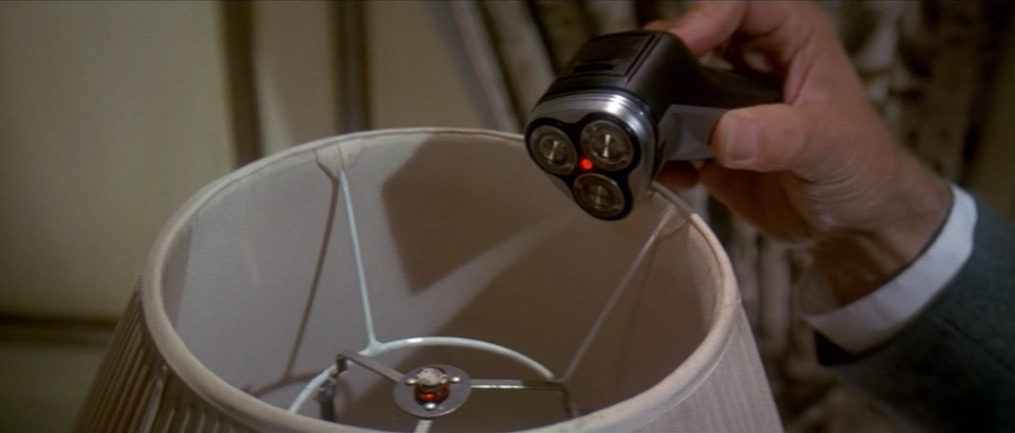
At what (x,y) coordinates should I click in order to perform the action: click on wall. Please return your answer as a coordinate pair (x, y). Looking at the image, I should click on (134, 69).